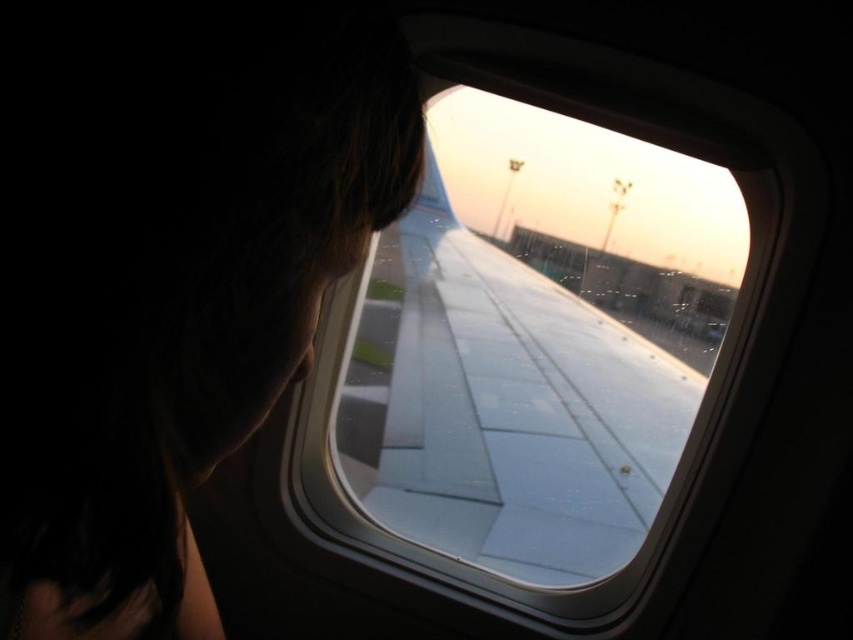
Does dark hair at left have a lesser width compared to transparent glass wing at center?

Correct, dark hair at left's width is less than transparent glass wing at center's.

Which is in front, point (260, 356) or point (300, 472)?

Point (260, 356) is in front.

Does point (177, 285) come behind point (579, 472)?

No, (177, 285) is closer to viewer.

Locate an element on the screen. This screenshot has height=640, width=853. dark hair at left is located at coordinates (169, 273).